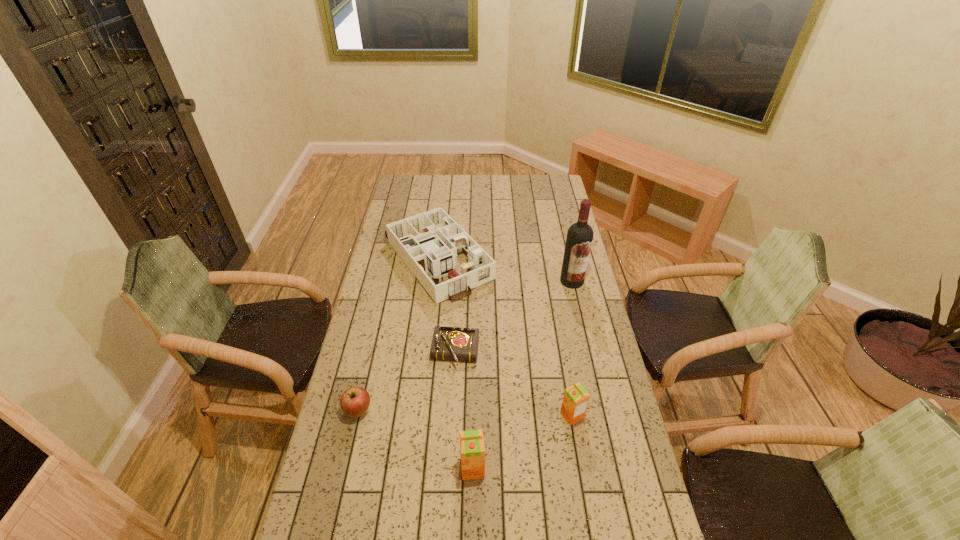
The height and width of the screenshot is (540, 960). In order to click on empty space between the shortest object and the dollhouse in this screenshot , I will do `click(446, 305)`.

The image size is (960, 540). I want to click on free spot between the farther orange juice and the dollhouse, so click(x=505, y=336).

I want to click on empty location between the apple and the diary, so (407, 382).

This screenshot has height=540, width=960. In order to click on free spot between the apple and the nearest object in this screenshot , I will do `click(416, 440)`.

Locate an element on the screen. This screenshot has width=960, height=540. free space between the wine bottle and the fifth shortest object is located at coordinates (522, 375).

Point out which object is positioned as the nearest to the left orange juice. Please provide its 2D coordinates. Your answer should be formatted as a tuple, i.e. [(x, y)], where the tuple contains the x and y coordinates of a point satisfying the conditions above.

[(575, 401)]

At what (x,y) coordinates should I click in order to perform the action: click on object that stands as the fifth closest to the rightmost object. Please return your answer as a coordinate pair (x, y). Looking at the image, I should click on [x=354, y=402].

Identify the location of free spot that satisfies the following two spatial constraints: 1. on the front side of the shorter orange juice; 2. on the left side of the apple. (357, 416).

The height and width of the screenshot is (540, 960). What are the coordinates of `free spot that satisfies the following two spatial constraints: 1. on the back side of the shortest object; 2. on the right side of the apple` in the screenshot? It's located at (372, 353).

Identify the location of free point that satisfies the following two spatial constraints: 1. on the front side of the third farthest object; 2. on the left side of the shorter orange juice. The height and width of the screenshot is (540, 960). (452, 416).